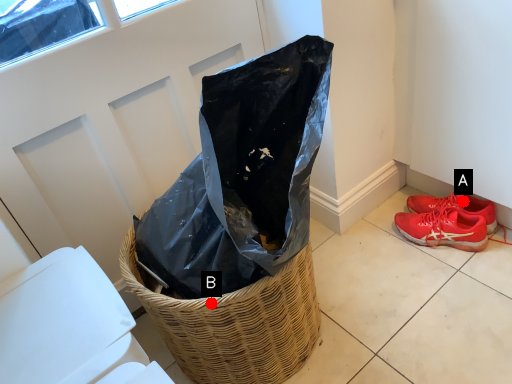
Question: Two points are circled on the image, labeled by A and B beside each circle. Among these points, which one is nearest to the camera?

Choices:
 (A) A is closer
 (B) B is closer

Answer: (B)